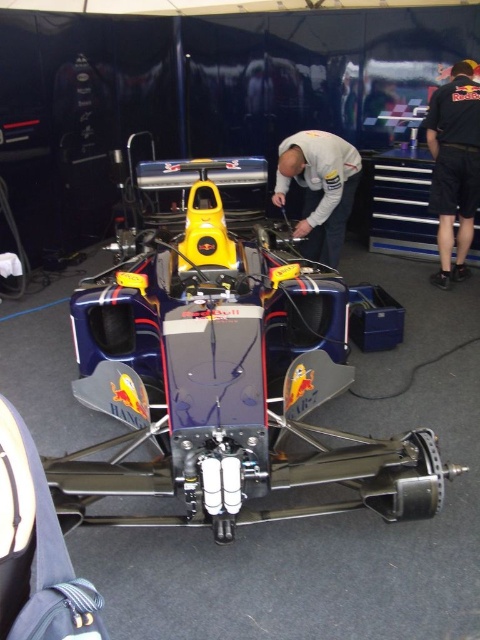
Between metallic blue race car at center and white matte shirt at center, which one appears on the left side from the viewer's perspective?

metallic blue race car at center is more to the left.

Which of these two, metallic blue race car at center or white matte shirt at center, stands shorter?

white matte shirt at center is shorter.

Who is more forward, (240,436) or (311,209)?

Point (240,436)

Identify the location of metallic blue race car at center. The image size is (480, 640). (227, 381).

What do you see at coordinates (454, 166) in the screenshot? The height and width of the screenshot is (640, 480). I see `black fabric pants at right` at bounding box center [454, 166].

Describe the element at coordinates (454, 166) in the screenshot. I see `black fabric pants at right` at that location.

Where is `black fabric pants at right`? This screenshot has width=480, height=640. black fabric pants at right is located at coordinates (454, 166).

Is metallic blue race car at center above black fabric pants at right?

No.

Which of these two, metallic blue race car at center or black fabric pants at right, stands shorter?

With less height is metallic blue race car at center.

The width and height of the screenshot is (480, 640). What are the coordinates of `metallic blue race car at center` in the screenshot? It's located at (227, 381).